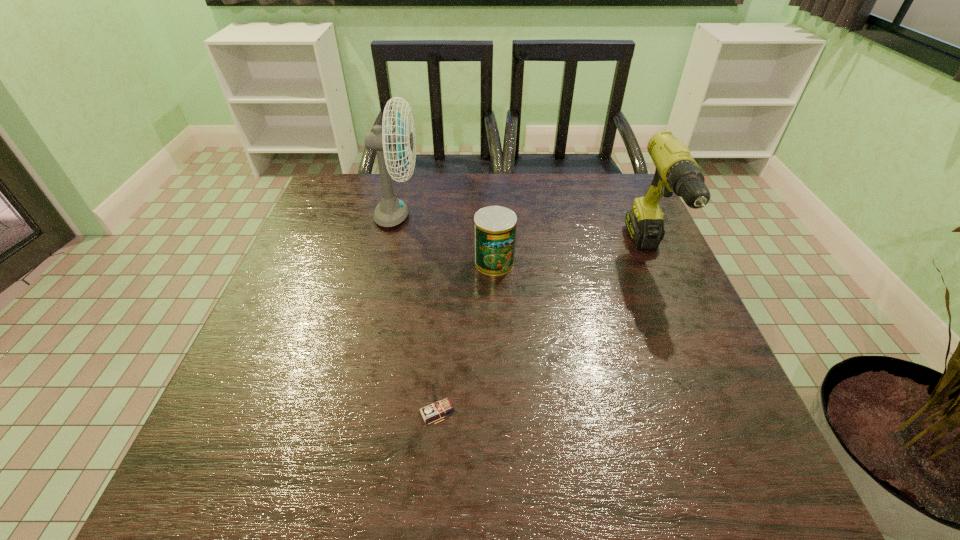
This screenshot has width=960, height=540. I want to click on the leftmost object, so click(x=391, y=211).

Where is `the second tallest object`? The image size is (960, 540). the second tallest object is located at coordinates (676, 171).

At what (x,y) coordinates should I click in order to perform the action: click on the rightmost object. Please return your answer as a coordinate pair (x, y). This screenshot has width=960, height=540. Looking at the image, I should click on (676, 171).

The height and width of the screenshot is (540, 960). I want to click on the second shortest object, so click(x=494, y=226).

Where is `the second object from right to left`? This screenshot has height=540, width=960. the second object from right to left is located at coordinates (494, 226).

What are the coordinates of `matchbox` in the screenshot? It's located at (437, 407).

This screenshot has width=960, height=540. I want to click on the nearest object, so click(x=437, y=407).

The height and width of the screenshot is (540, 960). What are the coordinates of `free space located on the front-facing side of the leftmost object` in the screenshot? It's located at (547, 218).

Image resolution: width=960 pixels, height=540 pixels. I want to click on vacant region located on the handle side of the rightmost object, so tap(696, 362).

Find the location of `free space located on the right of the third tallest object`. free space located on the right of the third tallest object is located at coordinates (629, 262).